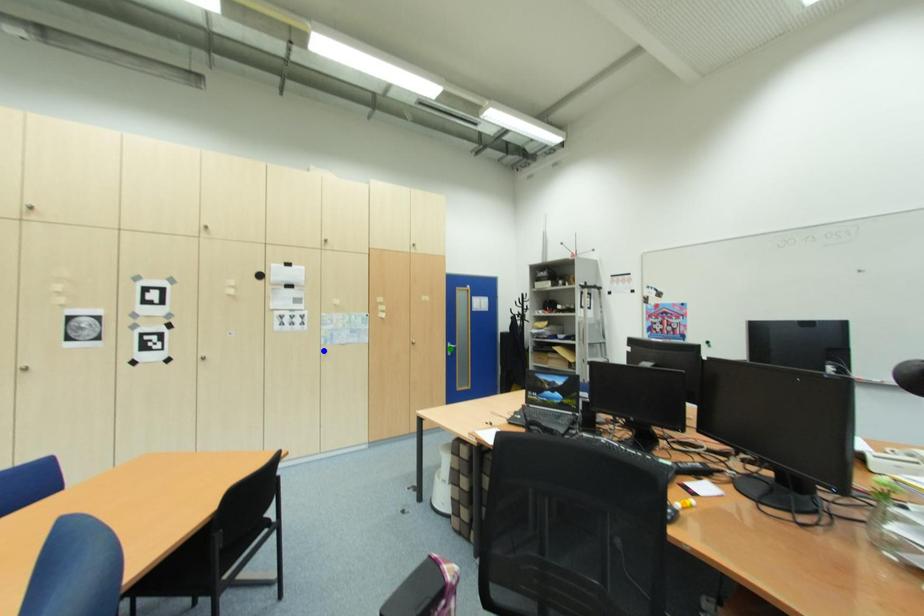
Looking at this image, order these from farthest to nearest:
A) green point
B) blue point
C) orange point

green point
blue point
orange point